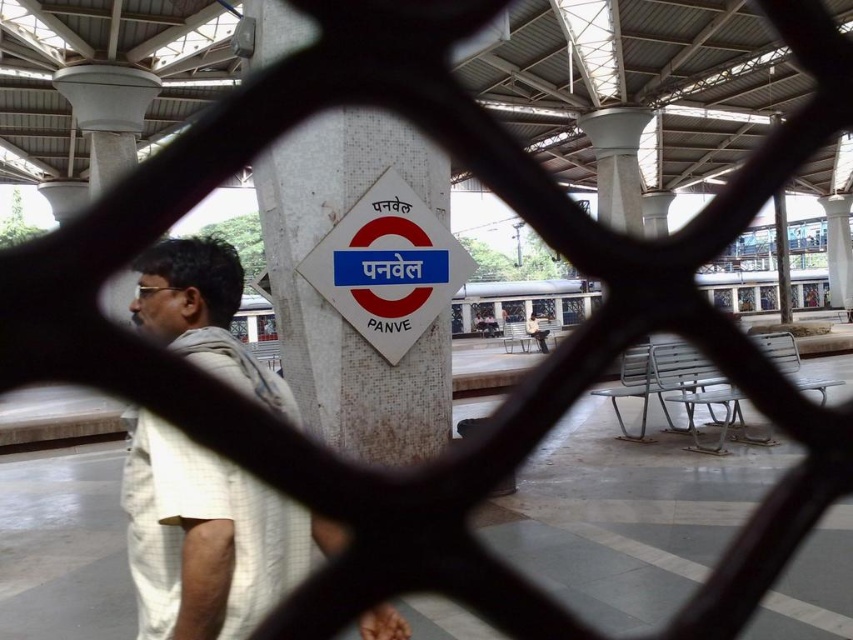
Who is positioned more to the left, white plastic sign at center or metallic pole at right?

From the viewer's perspective, white plastic sign at center appears more on the left side.

Can you confirm if white plastic sign at center is positioned to the right of metallic pole at right?

In fact, white plastic sign at center is to the left of metallic pole at right.

Where is `white plastic sign at center`? white plastic sign at center is located at coordinates (387, 266).

Is white cotton shirt at left above metallic pole at right?

Actually, white cotton shirt at left is below metallic pole at right.

Can you confirm if white cotton shirt at left is taller than metallic pole at right?

In fact, white cotton shirt at left may be shorter than metallic pole at right.

Which is behind, point (184, 540) or point (784, 292)?

The point (784, 292) is behind.

Locate an element on the screen. white cotton shirt at left is located at coordinates (207, 538).

Can you confirm if white mosaic tile sign at center is thinner than metallic pole at right?

Yes.

Is point (318, 292) behind point (775, 221)?

No.

The image size is (853, 640). I want to click on white mosaic tile sign at center, so click(x=331, y=307).